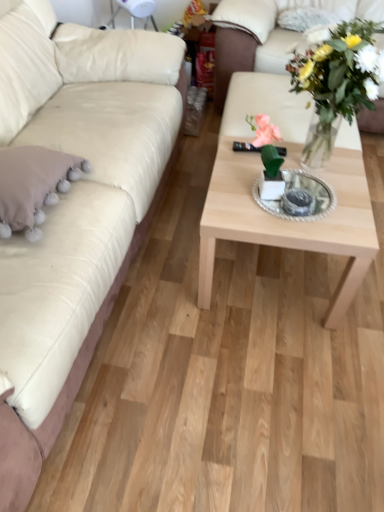
Where is `free space in front of natural wood coffee table at center`? free space in front of natural wood coffee table at center is located at coordinates (270, 371).